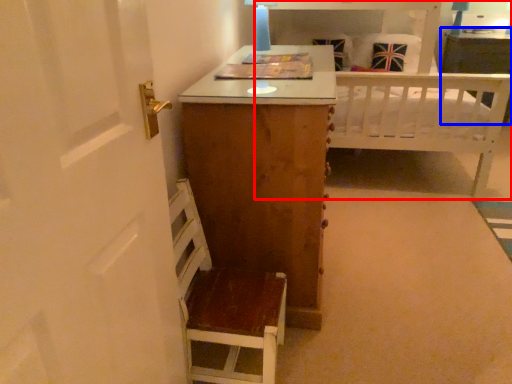
Question: Which object appears farthest to the camera in this image, bed (highlighted by a red box) or vanity (highlighted by a blue box)?

Choices:
 (A) bed
 (B) vanity

Answer: (B)